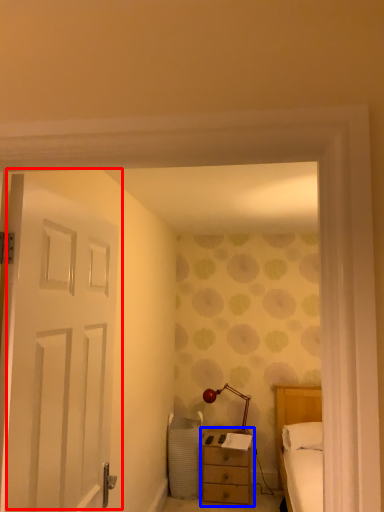
Question: Among these objects, which one is farthest to the camera, door (highlighted by a red box) or nightstand (highlighted by a blue box)?

Choices:
 (A) door
 (B) nightstand

Answer: (B)